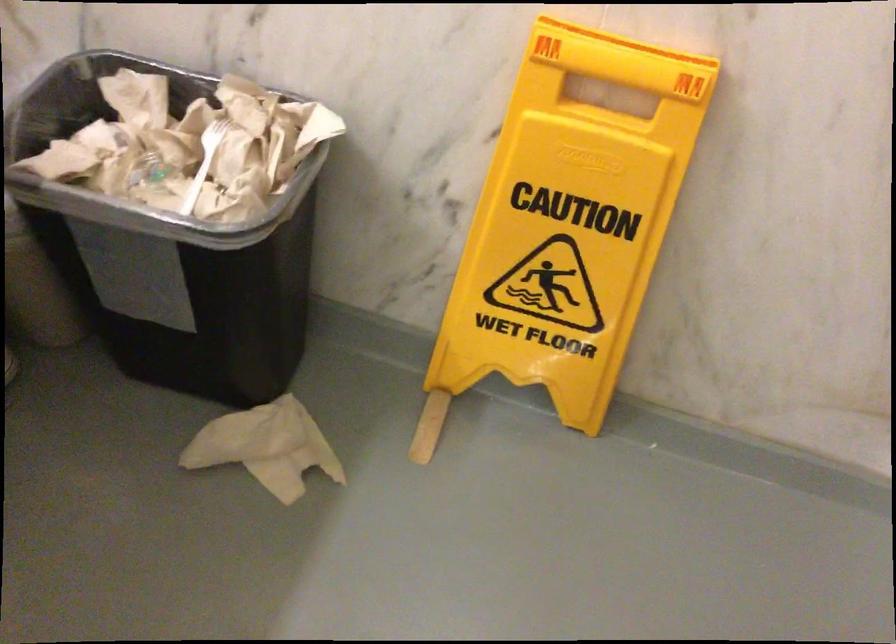
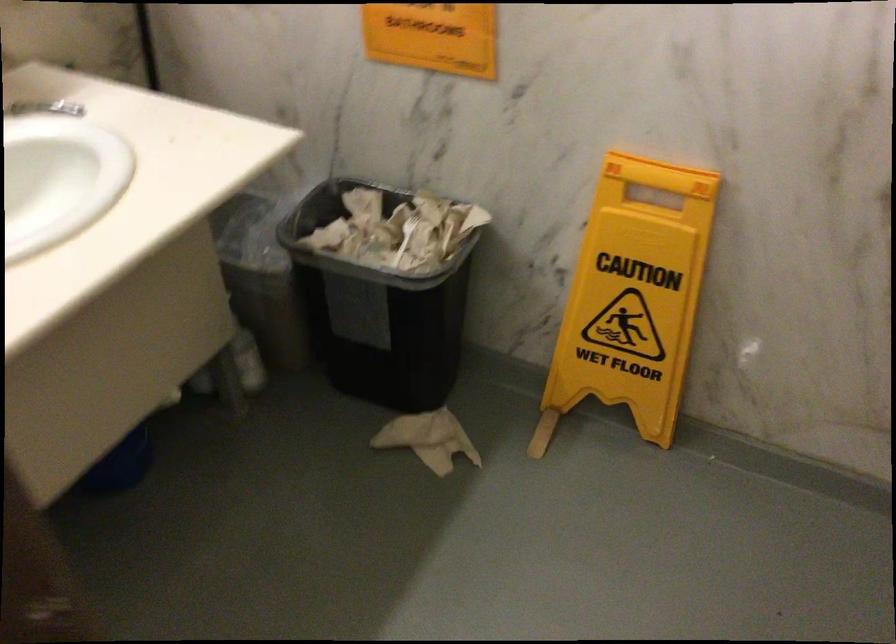
Question: What movement of the cameraman would produce the second image?

Choices:
 (A) Left
 (B) Right
 (C) Forward
 (D) Backward

Answer: (D)